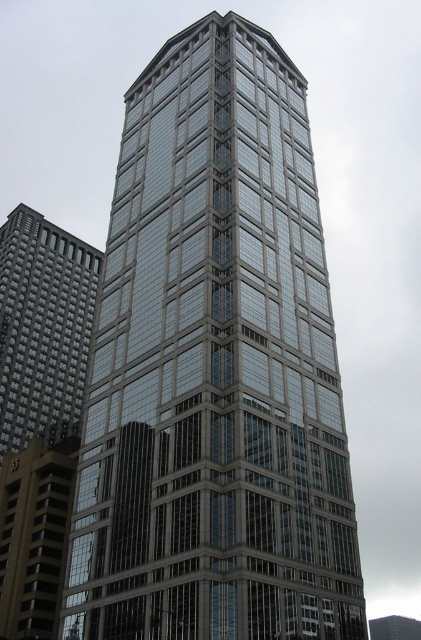
Question: Among these points, which one is farthest from the camera?

Choices:
 (A) (5, 413)
 (B) (264, 51)

Answer: (A)

Question: From the image, what is the correct spatial relationship of glassy steel tower at center in relation to matte gray building at left?

Choices:
 (A) left
 (B) right

Answer: (B)

Question: Is glassy steel tower at center to the left of matte gray building at left from the viewer's perspective?

Choices:
 (A) yes
 (B) no

Answer: (B)

Question: In this image, where is glassy steel tower at center located relative to matte gray building at left?

Choices:
 (A) right
 (B) left

Answer: (A)

Question: Which point is closer to the camera?

Choices:
 (A) click(x=181, y=474)
 (B) click(x=29, y=419)

Answer: (A)